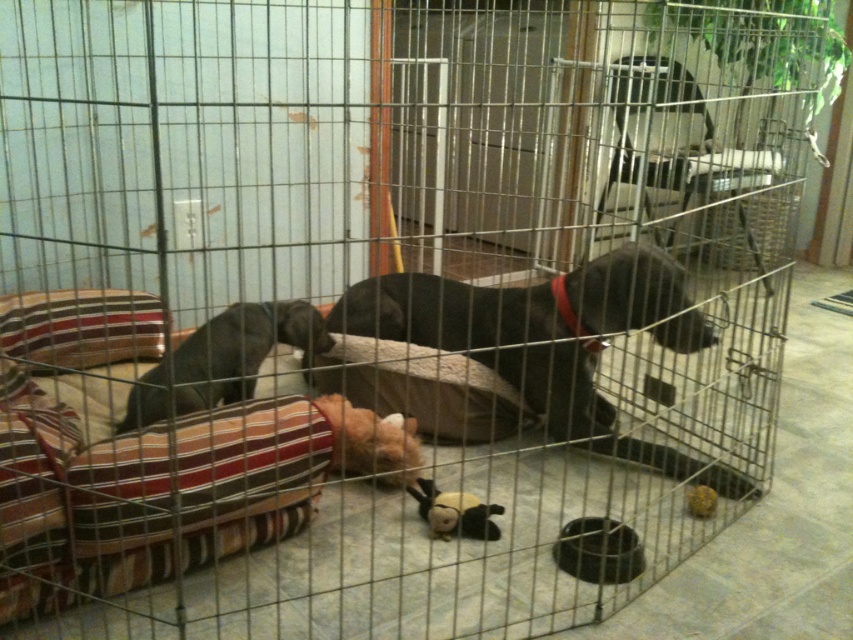
Question: Where is dark gray fur at left located in relation to black plush toy at center in the image?

Choices:
 (A) above
 (B) below

Answer: (A)

Question: Can you confirm if striped fabric dog bed at lower left is bigger than striped fabric pillow at left?

Choices:
 (A) no
 (B) yes

Answer: (B)

Question: Among these objects, which one is farthest from the camera?

Choices:
 (A) dark gray fur at left
 (B) soft plush pillow at center
 (C) fuzzy fabric stuffed animal at center

Answer: (B)

Question: Does striped fabric dog bed at lower left appear over black plush toy at center?

Choices:
 (A) no
 (B) yes

Answer: (B)

Question: Among these objects, which one is farthest from the camera?

Choices:
 (A) dark gray fur at left
 (B) rubber duck at lower right
 (C) soft plush pillow at center
 (D) striped fabric dog bed at lower left

Answer: (C)

Question: Which of the following is the closest to the observer?

Choices:
 (A) (433, 490)
 (B) (358, 412)
 (C) (704, 513)

Answer: (A)